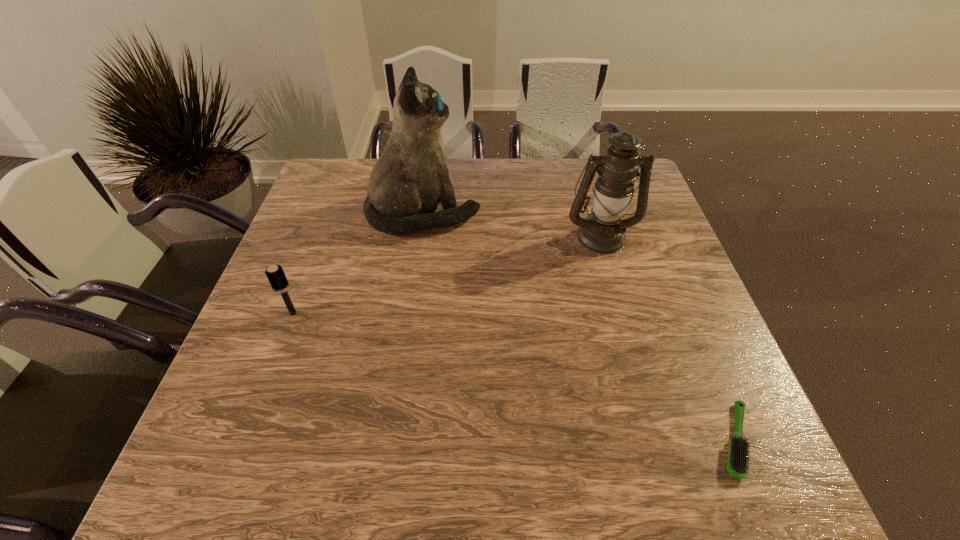
I want to click on free space between the shortest object and the second object from left to right, so click(579, 327).

The width and height of the screenshot is (960, 540). Identify the location of free spot between the second object from left to right and the nearest object. (579, 327).

This screenshot has height=540, width=960. What are the coordinates of `object that is the closest to the second tallest object` in the screenshot? It's located at (407, 182).

Identify the location of object identified as the second closest to the taller hairbrush. This screenshot has width=960, height=540. pos(603,231).

This screenshot has width=960, height=540. Find the location of `free space that satisfies the following two spatial constraints: 1. at the face of the tallest object; 2. on the left side of the oil lamp`. free space that satisfies the following two spatial constraints: 1. at the face of the tallest object; 2. on the left side of the oil lamp is located at coordinates (420, 236).

Locate an element on the screen. blank area in the image that satisfies the following two spatial constraints: 1. at the face of the cat; 2. on the front side of the second shortest object is located at coordinates (409, 313).